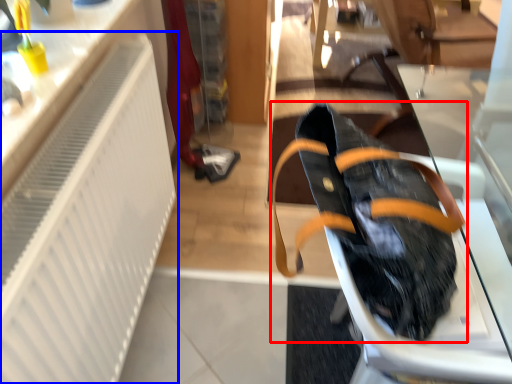
Question: Among these objects, which one is farthest to the camera, footwear (highlighted by a red box) or radiator (highlighted by a blue box)?

Choices:
 (A) footwear
 (B) radiator

Answer: (A)